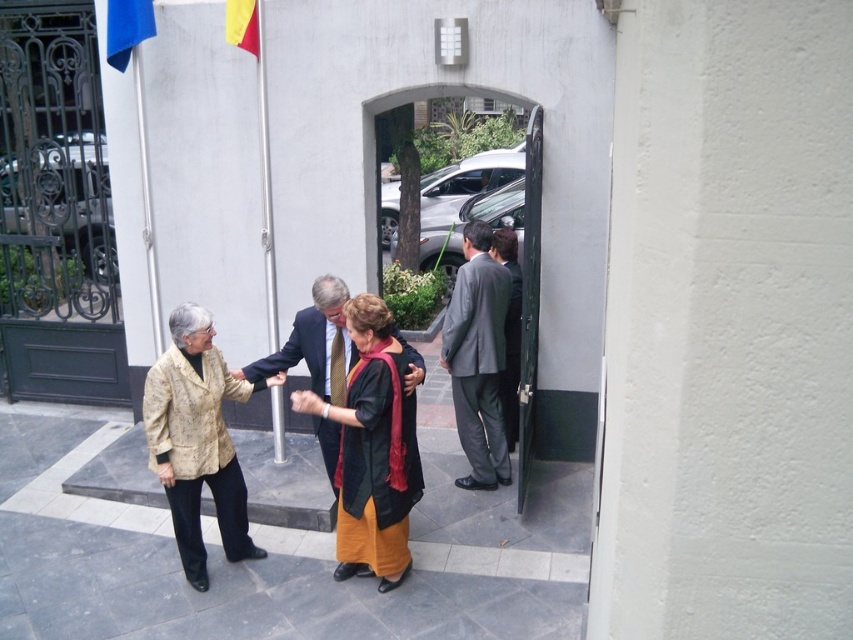
Does point (141, 35) come closer to viewer compared to point (228, 13)?

No.

Is point (137, 29) positioned after point (254, 45)?

Yes, it is behind point (254, 45).

Is point (113, 13) farther from viewer compared to point (253, 52)?

Yes, point (113, 13) is behind point (253, 52).

I want to click on blue fabric flag at upper left, so click(126, 28).

Is green matte door at center positioned before blue fabric flag at upper left?

Yes, it is in front of blue fabric flag at upper left.

Measure the distance between point (521, 432) and camera.

Point (521, 432) is 16.13 feet away from camera.

Is point (531, 432) closer to viewer compared to point (112, 52)?

Yes, point (531, 432) is closer to viewer.

Where is `green matte door at center`? Image resolution: width=853 pixels, height=640 pixels. green matte door at center is located at coordinates (529, 300).

Is point (469, 284) closer to viewer compared to point (115, 10)?

Yes, it is.

Does gray suit at right have a lesser width compared to blue fabric flag at upper left?

No.

Where is `gray suit at right`? gray suit at right is located at coordinates (479, 358).